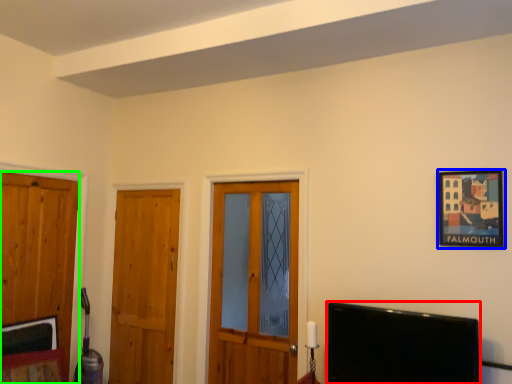
Question: Based on their relative distances, which object is nearer to television (highlighted by a red box)? Choose from picture frame (highlighted by a blue box) and door (highlighted by a green box).

Choices:
 (A) picture frame
 (B) door

Answer: (A)